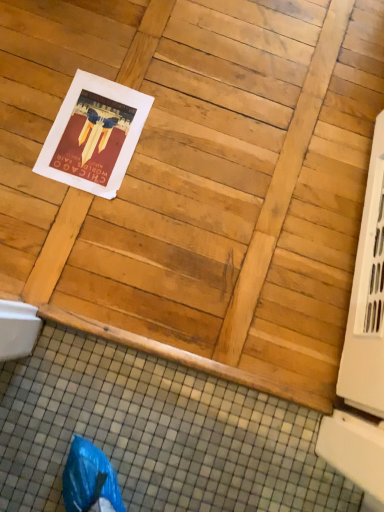
What do you see at coordinates (94, 135) in the screenshot? I see `white paper poster at upper left` at bounding box center [94, 135].

Locate an element on the screen. This screenshot has height=512, width=384. white paper poster at upper left is located at coordinates (94, 135).

Where is `white paper poster at upper left`? The width and height of the screenshot is (384, 512). white paper poster at upper left is located at coordinates (94, 135).